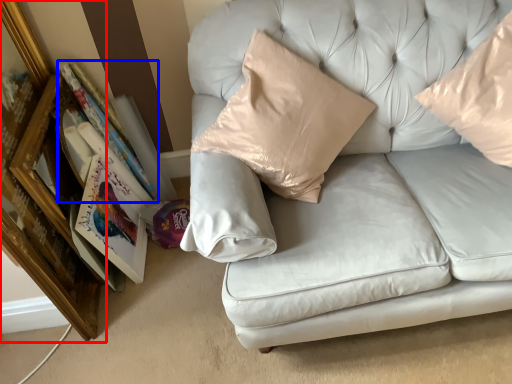
Question: Among these objects, which one is nearest to the camera, picture frame (highlighted by a red box) or book (highlighted by a blue box)?

Choices:
 (A) picture frame
 (B) book

Answer: (A)